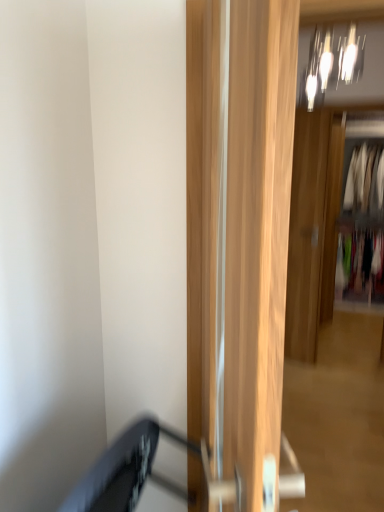
Describe the element at coordinates (331, 64) in the screenshot. I see `metallic glass light fixture at upper center` at that location.

What is the approximate height of metallic glass light fixture at upper center?

16.61 inches.

At what (x,y) coordinates should I click in order to perform the action: click on light wood door at center, the first door in the left-to-right sequence. Please return your answer as a coordinate pair (x, y). Looking at the image, I should click on (238, 244).

The image size is (384, 512). Describe the element at coordinates (362, 225) in the screenshot. I see `white fabric clothes at right, which is the second clothing from top to bottom` at that location.

In the scene shown: Measure the distance between point (x=374, y=273) and camera.

Point (x=374, y=273) and camera are 5.20 meters apart from each other.

Find the location of `metallic glass light fixture at upper center`. metallic glass light fixture at upper center is located at coordinates (331, 64).

Considering the relative sizes of light wood door at center, acting as the 1th door starting from the front, and silky white blouse at upper right, acting as the 3th clothing starting from the bottom, in the image provided, is light wood door at center, acting as the 1th door starting from the front, thinner than silky white blouse at upper right, acting as the 3th clothing starting from the bottom,?

Yes, light wood door at center, acting as the 1th door starting from the front, is thinner than silky white blouse at upper right, acting as the 3th clothing starting from the bottom.

I want to click on the 3rd clothing above when counting from the light wood door at center, arranged as the second door when viewed from the back (from the image's perspective), so click(363, 179).

Considering the positions of points (237, 87) and (359, 173), is point (237, 87) closer to camera compared to point (359, 173)?

Yes, it is in front of point (359, 173).

Is wooden door at center, the first door viewed from the right, outside of metallic glass light fixture at upper center?

Indeed, wooden door at center, the first door viewed from the right, is completely outside metallic glass light fixture at upper center.

From the image's perspective, which is below, wooden door at center, the first door viewed from the right, or metallic glass light fixture at upper center?

wooden door at center, the first door viewed from the right, from the image's perspective.

Which object is wider, wooden door at center, which is the second door from left to right, or metallic glass light fixture at upper center?

Wider between the two is metallic glass light fixture at upper center.

Is wooden door at center, acting as the first door starting from the back, facing towards metallic glass light fixture at upper center?

No, wooden door at center, acting as the first door starting from the back, is not oriented towards metallic glass light fixture at upper center.

Who is smaller, light wood door at center, the second door in the right-to-left sequence, or wooden door at center, which is the second door from left to right?

wooden door at center, which is the second door from left to right.

Is light wood door at center, the second door in the right-to-left sequence, to the left of wooden door at center, arranged as the 2th door when viewed from the front, from the viewer's perspective?

Indeed, light wood door at center, the second door in the right-to-left sequence, is positioned on the left side of wooden door at center, arranged as the 2th door when viewed from the front.

You are a GUI agent. You are given a task and a screenshot of the screen. Output one action in this format:
    pyautogui.click(x=<x>, y=<y>)
    Task: Click on the door above the wooden door at center, which is the second door from left to right (from a real-world perspective)
    This screenshot has width=384, height=512.
    Given the screenshot: What is the action you would take?
    pyautogui.click(x=238, y=244)

Which object is positioned more to the left, metallic glass light fixture at upper center or wooden door at center, the first door viewed from the right?

metallic glass light fixture at upper center is more to the left.

Which object is further away from the camera, metallic glass light fixture at upper center or wooden door at center, the first door viewed from the right?

wooden door at center, the first door viewed from the right, is behind.

Looking at this image, in terms of size, does metallic glass light fixture at upper center appear bigger or smaller than wooden door at center, arranged as the 2th door when viewed from the front?

Clearly, metallic glass light fixture at upper center is smaller in size than wooden door at center, arranged as the 2th door when viewed from the front.

Is there a large distance between metallic glass light fixture at upper center and white fabric clothes at right, positioned as the 2th clothing in bottom-to-top order?

Yes, metallic glass light fixture at upper center and white fabric clothes at right, positioned as the 2th clothing in bottom-to-top order, are quite far apart.

Is metallic glass light fixture at upper center inside or outside of white fabric clothes at right, positioned as the 2th clothing in bottom-to-top order?

metallic glass light fixture at upper center is spatially situated outside white fabric clothes at right, positioned as the 2th clothing in bottom-to-top order.

Is metallic glass light fixture at upper center facing away from white fabric clothes at right, positioned as the 2th clothing in bottom-to-top order?

Yes, white fabric clothes at right, positioned as the 2th clothing in bottom-to-top order, is at the back of metallic glass light fixture at upper center.

Considering the relative sizes of metallic glass light fixture at upper center and white fabric clothes at right, positioned as the 2th clothing in bottom-to-top order, in the image provided, is metallic glass light fixture at upper center taller than white fabric clothes at right, positioned as the 2th clothing in bottom-to-top order,?

In fact, metallic glass light fixture at upper center may be shorter than white fabric clothes at right, positioned as the 2th clothing in bottom-to-top order.

Is metallic glass light fixture at upper center shorter than multicolored fabric at right, the 1th clothing from the bottom?

Indeed, metallic glass light fixture at upper center has a lesser height compared to multicolored fabric at right, the 1th clothing from the bottom.

Identify the location of light fixture lying on the left of multicolored fabric at right, the 1th clothing from the bottom. (331, 64).

Between point (314, 42) and point (370, 252), which one is positioned behind?

Positioned behind is point (370, 252).

How distant is metallic glass light fixture at upper center from multicolored fabric at right, acting as the 3th clothing starting from the top?

A distance of 8.12 feet exists between metallic glass light fixture at upper center and multicolored fabric at right, acting as the 3th clothing starting from the top.

Which object is further away from the camera, multicolored fabric at right, the 1th clothing from the bottom, or silky white blouse at upper right, which is the 1th clothing from top to bottom?

Positioned behind is multicolored fabric at right, the 1th clothing from the bottom.

Are multicolored fabric at right, the 1th clothing from the bottom, and silky white blouse at upper right, which is the 1th clothing from top to bottom, located far from each other?

No.

Looking at the image, does multicolored fabric at right, acting as the 3th clothing starting from the top, seem bigger or smaller compared to silky white blouse at upper right, acting as the 3th clothing starting from the bottom?

Clearly, multicolored fabric at right, acting as the 3th clothing starting from the top, is larger in size than silky white blouse at upper right, acting as the 3th clothing starting from the bottom.

From the silky white blouse at upper right, which is the 1th clothing from top to bottom, count 2nd doors forward and point to it. Please provide its 2D coordinates.

[(238, 244)]

Locate an element on the screen. This screenshot has height=512, width=384. door behind the metallic glass light fixture at upper center is located at coordinates (306, 232).

When comparing their distances from light wood door at center, acting as the 1th door starting from the front, does multicolored fabric at right, acting as the 3th clothing starting from the top, or silky white blouse at upper right, which is the 1th clothing from top to bottom, seem further?

silky white blouse at upper right, which is the 1th clothing from top to bottom, lies further to light wood door at center, acting as the 1th door starting from the front, than the other object.

Estimate the real-world distances between objects in this image. Which object is further from wooden door at center, arranged as the 2th door when viewed from the front, silky white blouse at upper right, acting as the 3th clothing starting from the bottom, or white fabric clothes at right, which is the second clothing from top to bottom?

silky white blouse at upper right, acting as the 3th clothing starting from the bottom, lies further to wooden door at center, arranged as the 2th door when viewed from the front, than the other object.

Which object lies nearer to the anchor point wooden door at center, acting as the first door starting from the back, multicolored fabric at right, acting as the 3th clothing starting from the top, or white fabric clothes at right, which is the second clothing from top to bottom?

white fabric clothes at right, which is the second clothing from top to bottom, lies closer to wooden door at center, acting as the first door starting from the back, than the other object.

Based on their spatial positions, is light wood door at center, the second door in the right-to-left sequence, or wooden door at center, acting as the first door starting from the back, closer to multicolored fabric at right, acting as the 3th clothing starting from the top?

wooden door at center, acting as the first door starting from the back.

Which object lies nearer to the anchor point silky white blouse at upper right, acting as the 3th clothing starting from the bottom, multicolored fabric at right, the 1th clothing from the bottom, or light wood door at center, the first door in the left-to-right sequence?

Based on the image, multicolored fabric at right, the 1th clothing from the bottom, appears to be nearer to silky white blouse at upper right, acting as the 3th clothing starting from the bottom.

Based on the photo, looking at the image, which one is located further to white fabric clothes at right, which is the second clothing from top to bottom, metallic glass light fixture at upper center or wooden door at center, which is the second door from left to right?

The object further to white fabric clothes at right, which is the second clothing from top to bottom, is metallic glass light fixture at upper center.

Based on their spatial positions, is multicolored fabric at right, acting as the 3th clothing starting from the top, or light wood door at center, the first door in the left-to-right sequence, closer to metallic glass light fixture at upper center?

light wood door at center, the first door in the left-to-right sequence, lies closer to metallic glass light fixture at upper center than the other object.

Which object lies nearer to the anchor point metallic glass light fixture at upper center, multicolored fabric at right, acting as the 3th clothing starting from the top, or wooden door at center, which is the second door from left to right?

wooden door at center, which is the second door from left to right.

This screenshot has width=384, height=512. Find the location of `light fixture between light wood door at center, the first door in the left-to-right sequence, and white fabric clothes at right, positioned as the 2th clothing in bottom-to-top order, from front to back`. light fixture between light wood door at center, the first door in the left-to-right sequence, and white fabric clothes at right, positioned as the 2th clothing in bottom-to-top order, from front to back is located at coordinates (331, 64).

Identify the location of door positioned between metallic glass light fixture at upper center and silky white blouse at upper right, acting as the 3th clothing starting from the bottom, from near to far. This screenshot has width=384, height=512. (306, 232).

Identify the location of door located between metallic glass light fixture at upper center and white fabric clothes at right, positioned as the 2th clothing in bottom-to-top order, in the depth direction. (306, 232).

Locate an element on the screen. Image resolution: width=384 pixels, height=512 pixels. clothing between light wood door at center, the first door in the left-to-right sequence, and silky white blouse at upper right, which is the 1th clothing from top to bottom, along the z-axis is located at coordinates (362, 225).